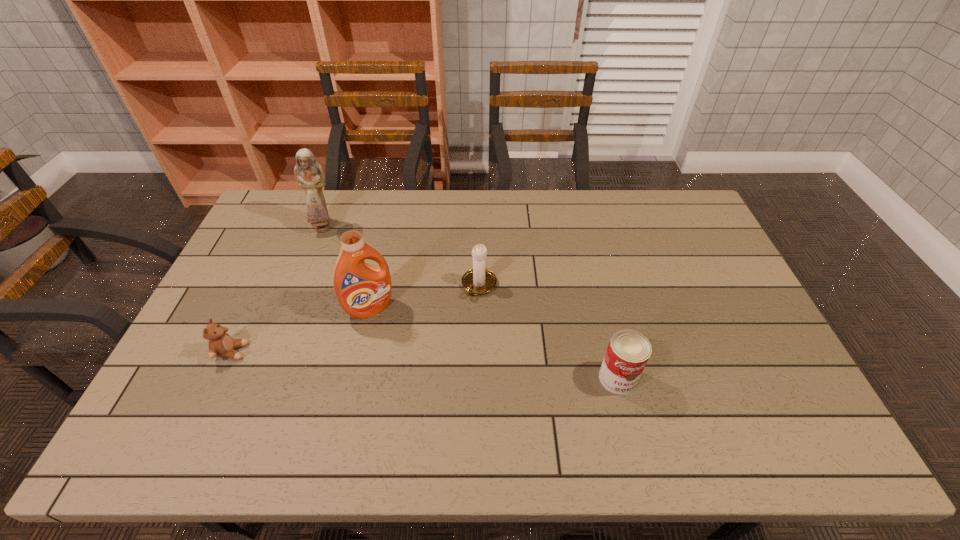
Find the location of a particular element. The height and width of the screenshot is (540, 960). object positioned at the left edge is located at coordinates (221, 344).

Identify the location of free spot at the far edge of the desktop. (371, 231).

The image size is (960, 540). I want to click on vacant space at the near edge, so point(452,381).

This screenshot has width=960, height=540. Find the location of `free region at the far left corner of the desktop`. free region at the far left corner of the desktop is located at coordinates (291, 194).

This screenshot has height=540, width=960. Identify the location of vacant space at the far right corner of the desktop. (689, 222).

You are a GUI agent. You are given a task and a screenshot of the screen. Output one action in this format:
    pyautogui.click(x=<x>, y=<y>)
    Task: Click on the empty location between the fourth tallest object and the second object from right to left
    This screenshot has height=540, width=960.
    Given the screenshot: What is the action you would take?
    pyautogui.click(x=548, y=332)

Image resolution: width=960 pixels, height=540 pixels. Identify the location of unoccupied position between the can and the candle holder. (548, 332).

Locate an element on the screen. This screenshot has height=540, width=960. unoccupied area between the fourth object from left to right and the farthest object is located at coordinates (401, 256).

The height and width of the screenshot is (540, 960). Find the location of `empty space that is in between the farthest object and the teddy bear`. empty space that is in between the farthest object and the teddy bear is located at coordinates (277, 289).

Find the location of a particular element. vacant space that is in between the fourth object from left to right and the leftmost object is located at coordinates (356, 319).